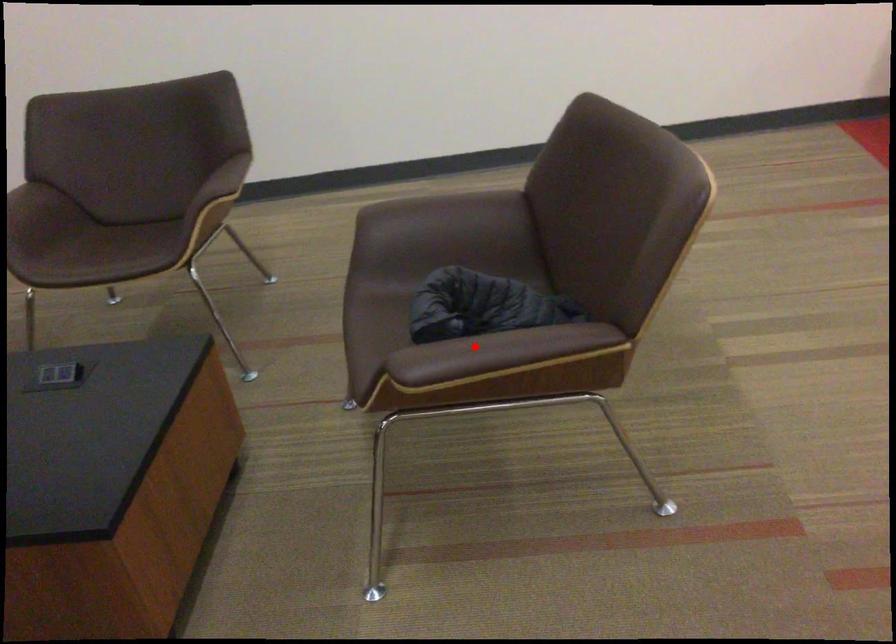
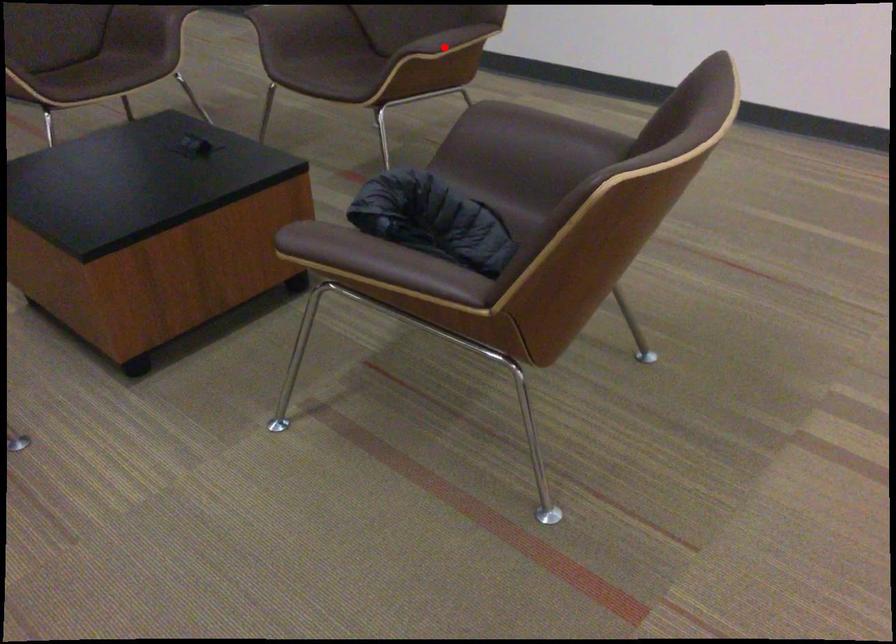
I am providing you with two images of the same scene from different viewpoints. A red point is marked on the first image and another point is marked on the second image. Is the red point in image1 aligned with the point shown in image2?

No